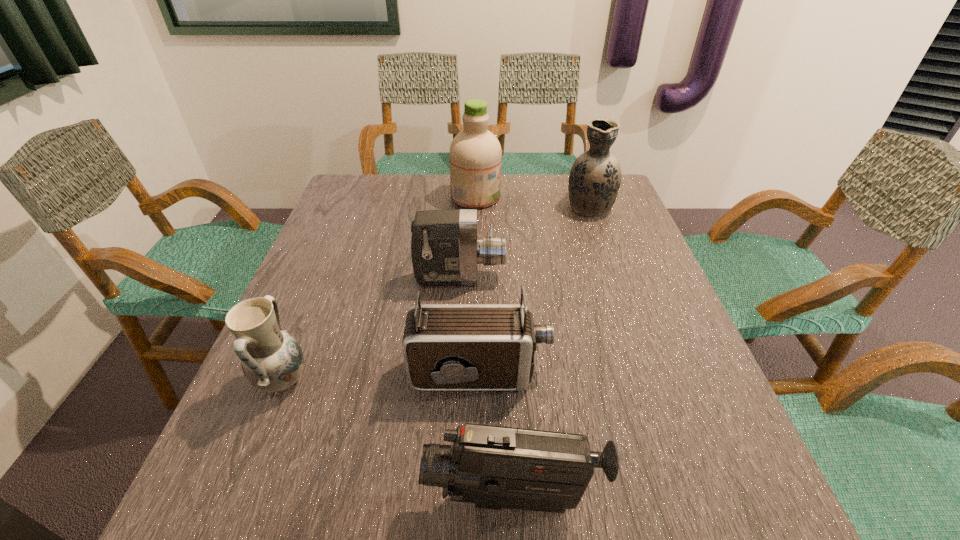
Where is `vacant space located 0.050m on the front-facing side of the nearest object`? The image size is (960, 540). vacant space located 0.050m on the front-facing side of the nearest object is located at coordinates (392, 500).

The image size is (960, 540). I want to click on free space located on the front-facing side of the nearest object, so click(x=322, y=500).

Where is `blank space located 0.170m on the front-facing side of the nearest object`? This screenshot has height=540, width=960. blank space located 0.170m on the front-facing side of the nearest object is located at coordinates (315, 500).

Where is `cleansing agent situated at the far edge`? The image size is (960, 540). cleansing agent situated at the far edge is located at coordinates (475, 153).

Identify the location of vase at the far edge. This screenshot has height=540, width=960. (595, 177).

Image resolution: width=960 pixels, height=540 pixels. Identify the location of object that is at the near edge. (494, 467).

The height and width of the screenshot is (540, 960). In order to click on object that is at the left edge in this screenshot , I will do `click(272, 360)`.

The image size is (960, 540). I want to click on object at the right edge, so click(595, 177).

Locate an element on the screen. The width and height of the screenshot is (960, 540). object that is positioned at the far right corner is located at coordinates (595, 177).

Locate an element on the screen. blank space at the far edge is located at coordinates (504, 202).